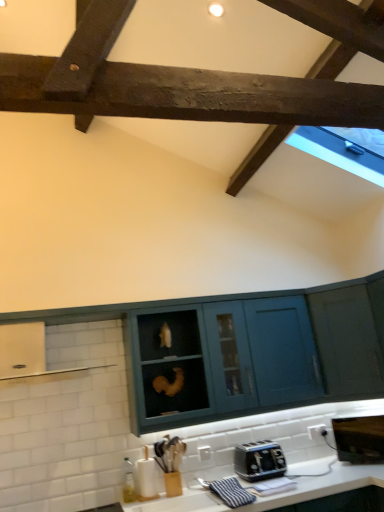
From the picture: Measure the distance between point (x=368, y=457) and camera.

The depth of point (x=368, y=457) is 9.29 feet.

What is the approximate width of teal matte cabinet at center, arranged as the first cabinetry when viewed from the left?

It is 6.75 centimeters.

What do you see at coordinates (220, 361) in the screenshot? The image size is (384, 512). I see `teal matte cabinet at center, which is the second cabinetry from left to right` at bounding box center [220, 361].

Describe the element at coordinates (350, 338) in the screenshot. I see `teal matte cabinet at right, arranged as the 1th cabinetry when viewed from the right` at that location.

Measure the distance between point (335, 492) and camera.

They are 8.22 feet apart.

Measure the distance between white glossy countertop at lower center and camera.

white glossy countertop at lower center is 2.32 meters away from camera.

At what (x,y) coordinates should I click in order to perform the action: click on white glossy exhaust hood at left. Please return your answer as a coordinate pair (x, y). The width and height of the screenshot is (384, 512). Looking at the image, I should click on (34, 354).

In the scene shown: Which object is thinner, black metallic microwave at lower right or black metallic toaster at lower center?

Thinner between the two is black metallic toaster at lower center.

Based on their positions, is black metallic microwave at lower right located to the left or right of black metallic toaster at lower center?

Based on their positions, black metallic microwave at lower right is located to the right of black metallic toaster at lower center.

Considering the relative sizes of black metallic microwave at lower right and black metallic toaster at lower center in the image provided, is black metallic microwave at lower right bigger than black metallic toaster at lower center?

Yes.

Considering their positions, is white glossy exhaust hood at left located in front of or behind white glossy countertop at lower center?

Clearly, white glossy exhaust hood at left is behind white glossy countertop at lower center.

Is white glossy exhaust hood at left smaller than white glossy countertop at lower center?

Yes, white glossy exhaust hood at left is smaller than white glossy countertop at lower center.

Considering the sizes of objects white glossy exhaust hood at left and white glossy countertop at lower center in the image provided, who is thinner, white glossy exhaust hood at left or white glossy countertop at lower center?

white glossy exhaust hood at left.

In the scene shown: Which point is more forward, (73, 371) or (208, 492)?

The point (208, 492) is more forward.

Can you confirm if black metallic toaster at lower center is wider than teal matte cabinet at center, which appears as the second cabinetry when viewed from the right?

No, black metallic toaster at lower center is not wider than teal matte cabinet at center, which appears as the second cabinetry when viewed from the right.

Is black metallic toaster at lower center facing towards teal matte cabinet at center, which appears as the second cabinetry when viewed from the right?

No, black metallic toaster at lower center is not oriented towards teal matte cabinet at center, which appears as the second cabinetry when viewed from the right.

From a real-world perspective, is black metallic toaster at lower center physically located above or below teal matte cabinet at center, which appears as the second cabinetry when viewed from the right?

In terms of real-world spatial position, black metallic toaster at lower center is below teal matte cabinet at center, which appears as the second cabinetry when viewed from the right.

Relative to teal matte cabinet at center, which is the second cabinetry from left to right, is black metallic toaster at lower center in front or behind?

In the image, black metallic toaster at lower center appears behind teal matte cabinet at center, which is the second cabinetry from left to right.

Find the location of a particular element. The height and width of the screenshot is (512, 384). countertop to the left of black metallic microwave at lower right is located at coordinates (323, 485).

Is black metallic microwave at lower right closer to the viewer compared to white glossy countertop at lower center?

No, the depth of black metallic microwave at lower right is greater than that of white glossy countertop at lower center.

Can you confirm if black metallic microwave at lower right is thinner than white glossy countertop at lower center?

Yes.

Is black metallic microwave at lower right aimed at white glossy countertop at lower center?

No, black metallic microwave at lower right is not oriented towards white glossy countertop at lower center.

Is black metallic toaster at lower center facing towards teal matte cabinet at right, arranged as the 1th cabinetry when viewed from the right?

No, black metallic toaster at lower center is not facing towards teal matte cabinet at right, arranged as the 1th cabinetry when viewed from the right.

Considering the relative sizes of black metallic toaster at lower center and teal matte cabinet at right, the third cabinetry in the left-to-right sequence, in the image provided, is black metallic toaster at lower center shorter than teal matte cabinet at right, the third cabinetry in the left-to-right sequence,?

Yes.

From the image's perspective, which is above, black metallic toaster at lower center or teal matte cabinet at right, the third cabinetry in the left-to-right sequence?

teal matte cabinet at right, the third cabinetry in the left-to-right sequence, from the image's perspective.

Locate an element on the screen. the 2nd cabinetry directly above the black metallic toaster at lower center (from a real-world perspective) is located at coordinates (350, 338).

From a real-world perspective, does black metallic microwave at lower right sit lower than teal matte cabinet at center, which is the second cabinetry from left to right?

Correct, in the physical world, black metallic microwave at lower right is lower than teal matte cabinet at center, which is the second cabinetry from left to right.

Find the location of a particular element. The height and width of the screenshot is (512, 384). the 2nd cabinetry positioned above the black metallic microwave at lower right (from the image's perspective) is located at coordinates (220, 361).

Is black metallic microwave at lower right not inside teal matte cabinet at center, which appears as the second cabinetry when viewed from the right?

Absolutely, black metallic microwave at lower right is external to teal matte cabinet at center, which appears as the second cabinetry when viewed from the right.

Are black metallic microwave at lower right and teal matte cabinet at center, which is the second cabinetry from left to right, making contact?

black metallic microwave at lower right and teal matte cabinet at center, which is the second cabinetry from left to right, are clearly separated.

Which is more to the right, teal matte cabinet at right, the third cabinetry in the left-to-right sequence, or black metallic microwave at lower right?

black metallic microwave at lower right.

Considering the relative sizes of teal matte cabinet at right, arranged as the 1th cabinetry when viewed from the right, and black metallic microwave at lower right in the image provided, is teal matte cabinet at right, arranged as the 1th cabinetry when viewed from the right, bigger than black metallic microwave at lower right?

Yes.

Is teal matte cabinet at right, arranged as the 1th cabinetry when viewed from the right, oriented towards black metallic microwave at lower right?

No, teal matte cabinet at right, arranged as the 1th cabinetry when viewed from the right, is not turned towards black metallic microwave at lower right.

How many degrees apart are the facing directions of teal matte cabinet at right, arranged as the 1th cabinetry when viewed from the right, and black metallic microwave at lower right?

teal matte cabinet at right, arranged as the 1th cabinetry when viewed from the right, and black metallic microwave at lower right are facing 45.1 degrees away from each other.

At what (x,y) coordinates should I click in order to perform the action: click on appliance lying behind the black metallic toaster at lower center. Please return your answer as a coordinate pair (x, y). The height and width of the screenshot is (512, 384). Looking at the image, I should click on (359, 439).

Locate an element on the screen. The width and height of the screenshot is (384, 512). exhaust hood above the white glossy countertop at lower center (from the image's perspective) is located at coordinates (34, 354).

In the scene shown: Estimate the real-world distances between objects in this image. Which object is closer to white glossy countertop at lower center, teal matte cabinet at center, which appears as the second cabinetry when viewed from the right, or teal matte cabinet at center, arranged as the first cabinetry when viewed from the left?

teal matte cabinet at center, which appears as the second cabinetry when viewed from the right, is closer to white glossy countertop at lower center.

Based on their spatial positions, is black metallic microwave at lower right or white glossy countertop at lower center closer to teal matte cabinet at center, positioned as the 3th cabinetry in right-to-left order?

black metallic microwave at lower right lies closer to teal matte cabinet at center, positioned as the 3th cabinetry in right-to-left order, than the other object.

Considering their positions, is teal matte cabinet at center, positioned as the 3th cabinetry in right-to-left order, positioned further to white glossy countertop at lower center than black metallic toaster at lower center?

teal matte cabinet at center, positioned as the 3th cabinetry in right-to-left order, lies further to white glossy countertop at lower center than the other object.

Which object lies nearer to the anchor point teal matte cabinet at right, the third cabinetry in the left-to-right sequence, teal matte cabinet at center, which appears as the second cabinetry when viewed from the right, or white glossy exhaust hood at left?

teal matte cabinet at center, which appears as the second cabinetry when viewed from the right, lies closer to teal matte cabinet at right, the third cabinetry in the left-to-right sequence, than the other object.

Estimate the real-world distances between objects in this image. Which object is further from black metallic toaster at lower center, teal matte cabinet at right, arranged as the 1th cabinetry when viewed from the right, or white glossy exhaust hood at left?

Among the two, white glossy exhaust hood at left is located further to black metallic toaster at lower center.

Estimate the real-world distances between objects in this image. Which object is closer to teal matte cabinet at center, positioned as the 3th cabinetry in right-to-left order, teal matte cabinet at center, which appears as the second cabinetry when viewed from the right, or teal matte cabinet at right, arranged as the 1th cabinetry when viewed from the right?

teal matte cabinet at center, which appears as the second cabinetry when viewed from the right, is closer to teal matte cabinet at center, positioned as the 3th cabinetry in right-to-left order.

Looking at the image, which one is located further to teal matte cabinet at center, which is the second cabinetry from left to right, black metallic toaster at lower center or white glossy countertop at lower center?

Among the two, white glossy countertop at lower center is located further to teal matte cabinet at center, which is the second cabinetry from left to right.

From the image, which object appears to be farther from black metallic microwave at lower right, teal matte cabinet at center, positioned as the 3th cabinetry in right-to-left order, or teal matte cabinet at center, which appears as the second cabinetry when viewed from the right?

teal matte cabinet at center, which appears as the second cabinetry when viewed from the right, is further to black metallic microwave at lower right.

At what (x,y) coordinates should I click in order to perform the action: click on countertop located between teal matte cabinet at center, arranged as the first cabinetry when viewed from the left, and teal matte cabinet at right, the third cabinetry in the left-to-right sequence, in the left-right direction. Please return your answer as a coordinate pair (x, y). The image size is (384, 512). Looking at the image, I should click on (323, 485).

The image size is (384, 512). I want to click on toaster between teal matte cabinet at center, which is the second cabinetry from left to right, and black metallic microwave at lower right, so click(x=259, y=460).

Identify the location of toaster that lies between teal matte cabinet at center, positioned as the 3th cabinetry in right-to-left order, and white glossy countertop at lower center from top to bottom. (259, 460).

The image size is (384, 512). Identify the location of cabinetry between white glossy exhaust hood at left and teal matte cabinet at center, which is the second cabinetry from left to right. (247, 351).